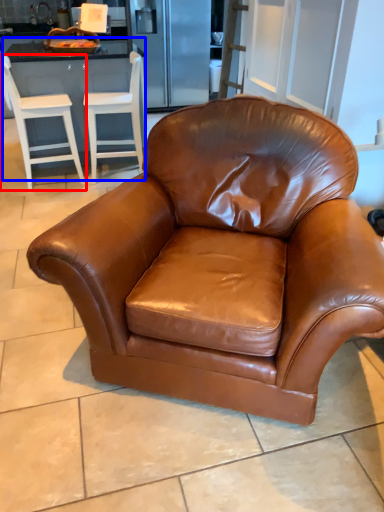
Question: Which of the following is the farthest to the observer, chair (highlighted by a red box) or dresser (highlighted by a blue box)?

Choices:
 (A) chair
 (B) dresser

Answer: (B)